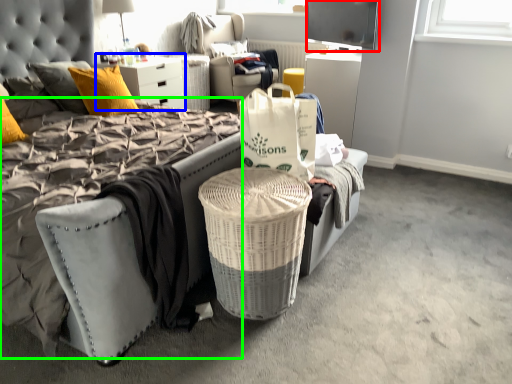
Question: Considering the real-world distances, which object is closest to television (highlighted by a red box)? dresser (highlighted by a blue box) or mattress (highlighted by a green box).

Choices:
 (A) dresser
 (B) mattress

Answer: (A)